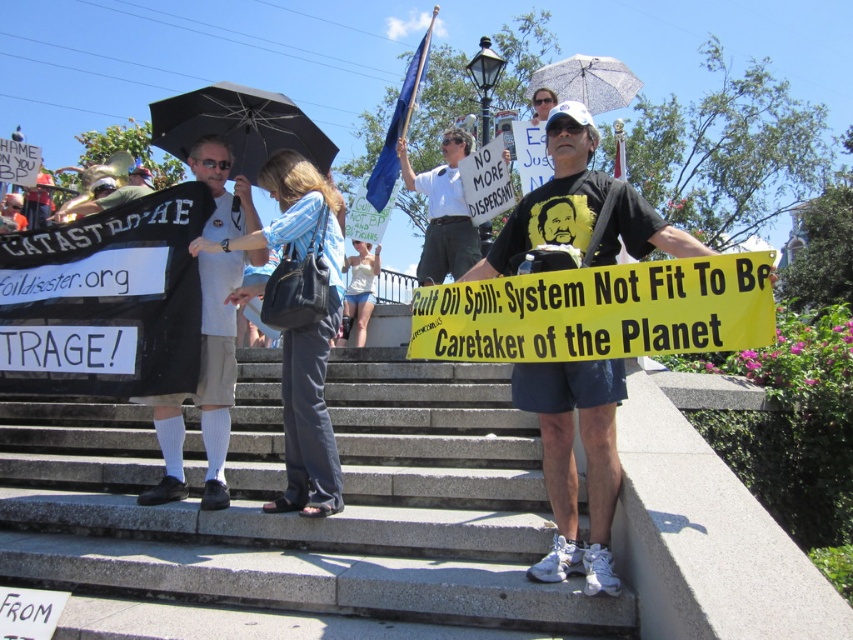
Which is in front, point (589, 132) or point (288, 100)?

Point (589, 132)

Find the location of a particular element. Image resolution: width=853 pixels, height=640 pixels. black t-shirt at center is located at coordinates (578, 212).

Who is lower down, black t-shirt at center or white paper sign at center?

black t-shirt at center

Can you confirm if black t-shirt at center is positioned above white paper sign at center?

Incorrect, black t-shirt at center is not positioned above white paper sign at center.

Is point (553, 410) closer to viewer compared to point (450, 262)?

Yes, it is in front of point (450, 262).

At what (x,y) coordinates should I click in order to perform the action: click on black t-shirt at center. Please return your answer as a coordinate pair (x, y). Looking at the image, I should click on (578, 212).

The image size is (853, 640). What do you see at coordinates (444, 211) in the screenshot?
I see `white paper sign at center` at bounding box center [444, 211].

This screenshot has height=640, width=853. What do you see at coordinates (444, 211) in the screenshot?
I see `white paper sign at center` at bounding box center [444, 211].

Where is `white paper sign at center`? white paper sign at center is located at coordinates (444, 211).